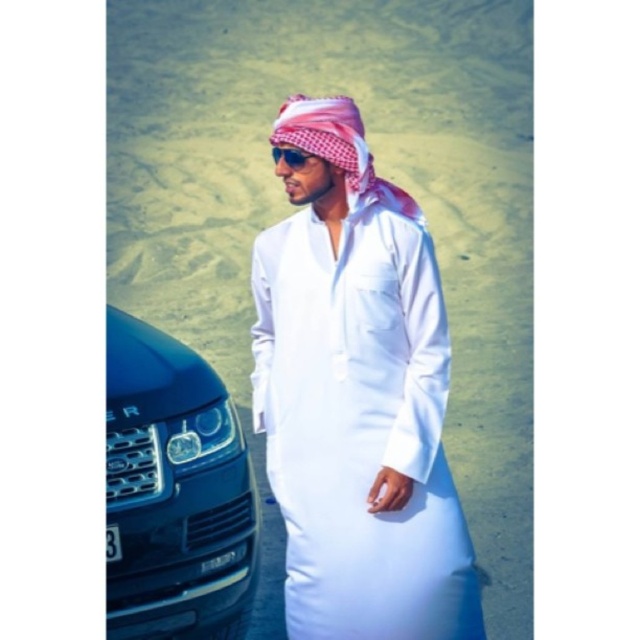
Question: Considering the real-world distances, which object is closest to the shiny blue car at left?

Choices:
 (A) white cotton thobe at center
 (B) sunglasses at center

Answer: (A)

Question: Which of these objects is positioned closest to the white cotton thobe at center?

Choices:
 (A) sunglasses at center
 (B) shiny blue car at left

Answer: (B)

Question: Can you confirm if shiny blue car at left is wider than sunglasses at center?

Choices:
 (A) yes
 (B) no

Answer: (A)

Question: Which is nearer to the shiny blue car at left?

Choices:
 (A) white cotton thobe at center
 (B) sunglasses at center
 (C) pink checkered headscarf at center

Answer: (A)

Question: Does white cotton thobe at center appear over pink checkered headscarf at center?

Choices:
 (A) yes
 (B) no

Answer: (B)

Question: Is pink checkered headscarf at center closer to the viewer compared to sunglasses at center?

Choices:
 (A) no
 (B) yes

Answer: (B)